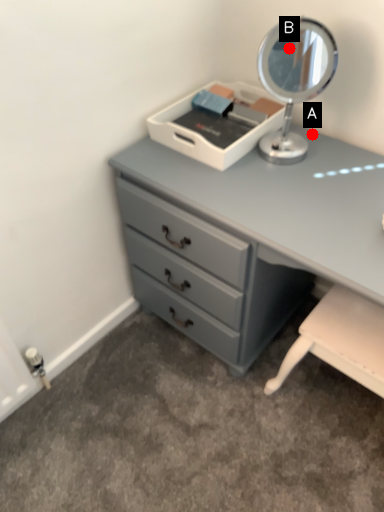
Question: Two points are circled on the image, labeled by A and B beside each circle. Which point is farther to the camera?

Choices:
 (A) A is further
 (B) B is further

Answer: (A)